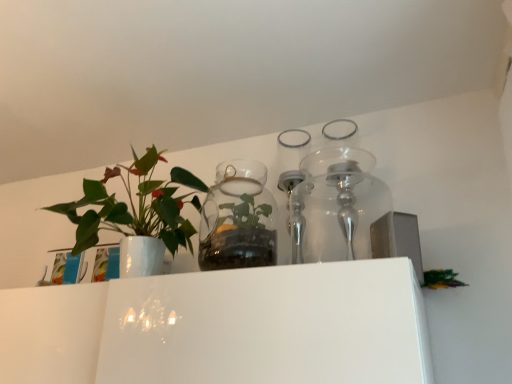
Question: In the image, is transparent glass terrarium at center positioned in front of or behind white glossy vase at left?

Choices:
 (A) behind
 (B) front

Answer: (A)

Question: Is point (227, 210) positioned closer to the camera than point (146, 200)?

Choices:
 (A) farther
 (B) closer

Answer: (A)

Question: Do you think transparent glass terrarium at center is within white glossy vase at left, or outside of it?

Choices:
 (A) inside
 (B) outside

Answer: (B)

Question: From the image's perspective, is white glossy vase at left above or below transparent glass terrarium at center?

Choices:
 (A) below
 (B) above

Answer: (B)

Question: In terms of height, does white glossy vase at left look taller or shorter compared to transparent glass terrarium at center?

Choices:
 (A) short
 (B) tall

Answer: (B)

Question: Is white glossy vase at left wider or thinner than transparent glass terrarium at center?

Choices:
 (A) thin
 (B) wide

Answer: (B)

Question: Considering the relative positions of white glossy vase at left and transparent glass terrarium at center in the image provided, is white glossy vase at left to the left or to the right of transparent glass terrarium at center?

Choices:
 (A) right
 (B) left

Answer: (B)